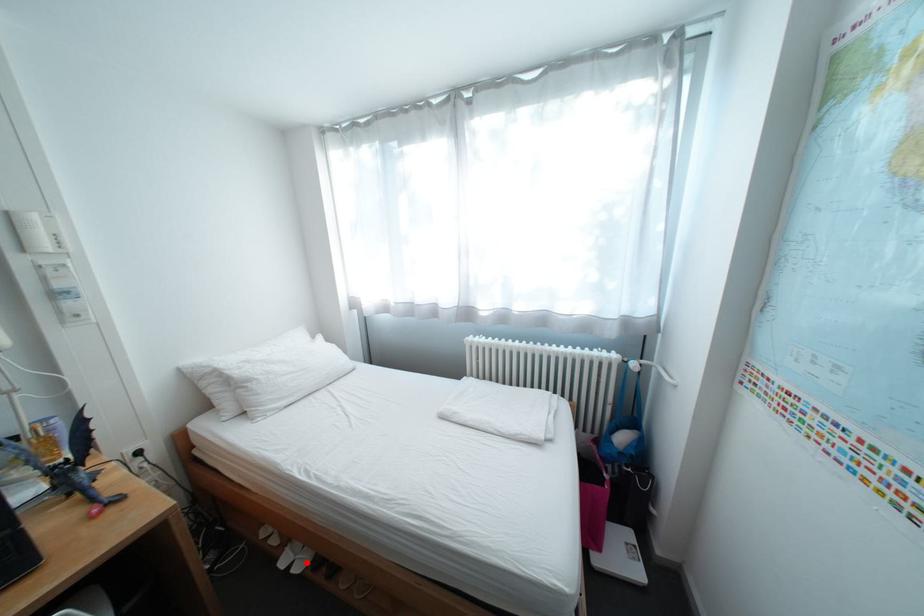
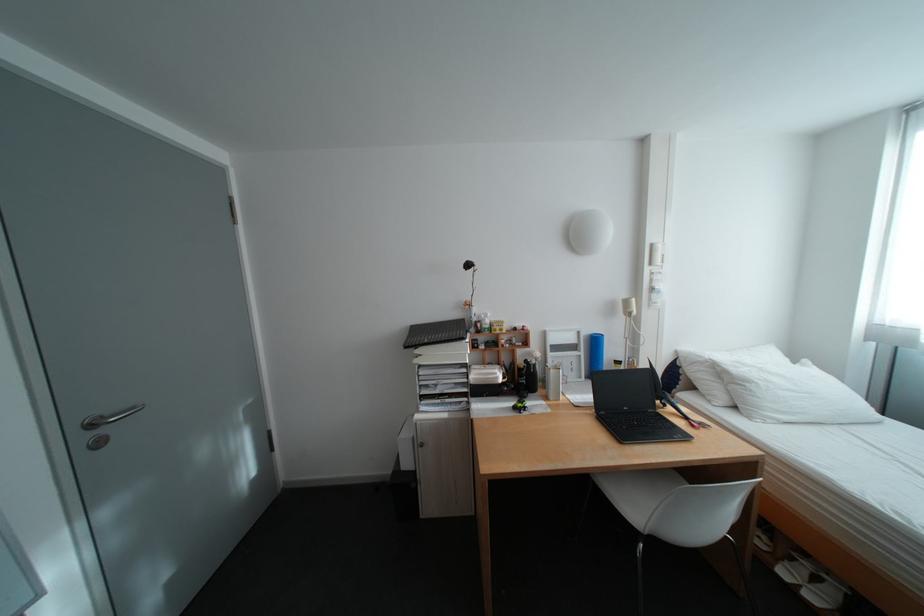
Question: I am providing you with two images of the same scene from different viewpoints. Given a red point in image1, look at the same physical point in image2. Is it:

Choices:
 (A) Closer to the viewpoint
 (B) Farther from the viewpoint

Answer: (B)